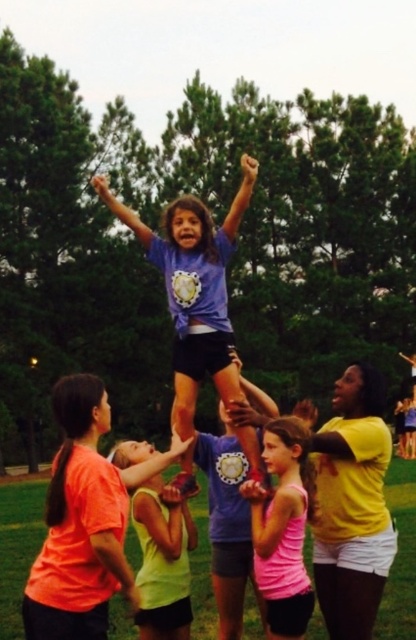
Does point (180, 205) come behind point (274, 630)?

Yes, it is behind point (274, 630).

Which of these two, purple matte shirt at center or pink matte shirt at center, stands shorter?

Standing shorter between the two is pink matte shirt at center.

Does point (200, 220) come farther from viewer compared to point (280, 600)?

Yes.

You are a GUI agent. You are given a task and a screenshot of the screen. Output one action in this format:
    pyautogui.click(x=<x>, y=<y>)
    Task: Click on the purple matte shirt at center
    
    Given the screenshot: What is the action you would take?
    193,289

Does pink matte shirt at center have a larger size compared to neon yellow tank top at center?

No, pink matte shirt at center is not bigger than neon yellow tank top at center.

Between pink matte shirt at center and neon yellow tank top at center, which one is positioned lower?

neon yellow tank top at center is lower down.

The image size is (416, 640). What do you see at coordinates (282, 528) in the screenshot?
I see `pink matte shirt at center` at bounding box center [282, 528].

Identify the location of pink matte shirt at center. (282, 528).

Is purple matte shirt at center positioned before neon yellow tank top at center?

No, purple matte shirt at center is further to the viewer.

Is point (185, 236) positioned behind point (182, 529)?

Yes, point (185, 236) is farther from viewer.

Image resolution: width=416 pixels, height=640 pixels. I want to click on purple matte shirt at center, so click(x=193, y=289).